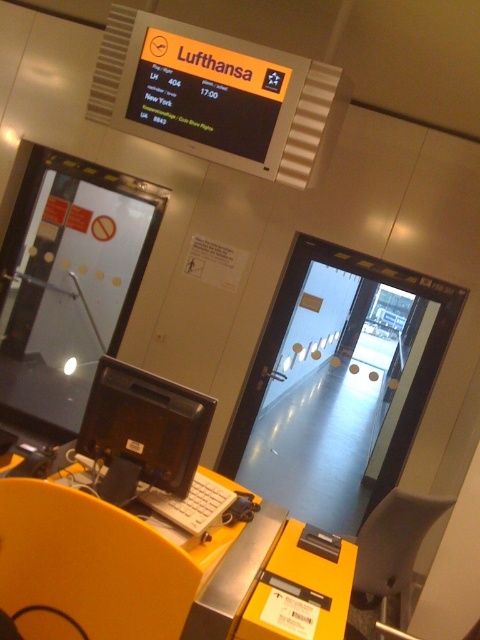
Question: Is yellow plastic table at lower left below black plastic monitor at lower center?

Choices:
 (A) no
 (B) yes

Answer: (B)

Question: Which object appears closest to the camera in this image?

Choices:
 (A) yellow plastic table at lower left
 (B) black plastic monitor at lower center
 (C) yellow plastic chair at lower left
 (D) black plastic chair at lower right

Answer: (C)

Question: Which point is closer to the camera?

Choices:
 (A) yellow plastic table at lower left
 (B) black plastic monitor at lower center

Answer: (A)

Question: Which of the following is the closest to the observer?

Choices:
 (A) black plastic monitor at lower center
 (B) black plastic chair at lower right
 (C) white plastic keyboard at center

Answer: (C)

Question: Does black plastic monitor at lower center have a lesser width compared to white plastic keyboard at center?

Choices:
 (A) no
 (B) yes

Answer: (A)

Question: Is black plastic monitor at lower center positioned behind white plastic keyboard at center?

Choices:
 (A) yes
 (B) no

Answer: (A)